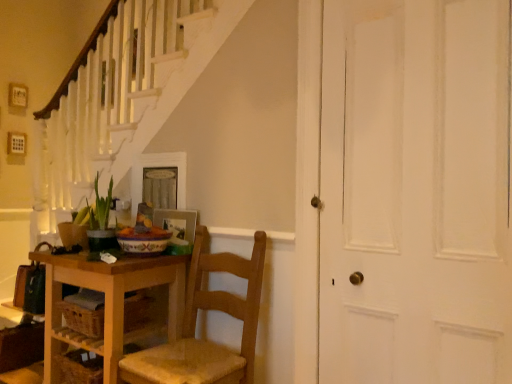
What is the approximate width of wooden drawer at lower left?

wooden drawer at lower left is 17.77 inches wide.

Where is `wooden picture frame at center, the 1th picture frame in the bottom-to-top sequence`? wooden picture frame at center, the 1th picture frame in the bottom-to-top sequence is located at coordinates (177, 223).

The height and width of the screenshot is (384, 512). Describe the element at coordinates (415, 193) in the screenshot. I see `white matte door at right` at that location.

This screenshot has height=384, width=512. Describe the element at coordinates (106, 302) in the screenshot. I see `wooden table at lower left` at that location.

Image resolution: width=512 pixels, height=384 pixels. Find the location of `wooden chair at center`. wooden chair at center is located at coordinates (195, 325).

Describe the element at coordinates (158, 166) in the screenshot. I see `wooden picture frame at lower left, acting as the 2th picture frame starting from the bottom` at that location.

Describe the element at coordinates (98, 220) in the screenshot. The width and height of the screenshot is (512, 384). I see `green leafy plant at lower left` at that location.

Find the location of a particular element. wooden drawer at lower left is located at coordinates (84, 312).

Is wooden picture frame at lower left, acting as the 2th picture frame starting from the bottom, positioned beyond the bounds of green leafy plant at lower left?

Indeed, wooden picture frame at lower left, acting as the 2th picture frame starting from the bottom, is completely outside green leafy plant at lower left.

From the image's perspective, does wooden picture frame at lower left, acting as the 2th picture frame starting from the bottom, appear lower than green leafy plant at lower left?

No.

Does wooden picture frame at lower left, acting as the 2th picture frame starting from the bottom, have a greater height compared to green leafy plant at lower left?

Correct, wooden picture frame at lower left, acting as the 2th picture frame starting from the bottom, is much taller as green leafy plant at lower left.

Is green leafy plant at lower left to the left of wooden picture frame at lower left, acting as the 2th picture frame starting from the bottom, from the viewer's perspective?

Correct, you'll find green leafy plant at lower left to the left of wooden picture frame at lower left, acting as the 2th picture frame starting from the bottom.

Which of these two, green leafy plant at lower left or wooden picture frame at lower left, acting as the 2th picture frame starting from the bottom, is thinner?

wooden picture frame at lower left, acting as the 2th picture frame starting from the bottom.

Is point (242, 336) closer or farther from the camera than point (100, 305)?

Clearly, point (242, 336) is closer to the camera than point (100, 305).

From the image's perspective, is wooden chair at center on top of wooden drawer at lower left?

Actually, wooden chair at center appears below wooden drawer at lower left in the image.

Is wooden chair at center far from wooden drawer at lower left?

That's not correct — wooden chair at center is a little close to wooden drawer at lower left.

Based on the photo, considering the relative positions of wooden chair at center and wooden drawer at lower left in the image provided, is wooden chair at center to the left or to the right of wooden drawer at lower left?

In the image, wooden chair at center appears on the right side of wooden drawer at lower left.

Which point is more forward, (249, 363) or (170, 307)?

The point (249, 363) is in front.

From the image's perspective, is wooden chair at center beneath wooden table at lower left?

No.

Is wooden chair at center outside of wooden table at lower left?

wooden chair at center lies outside wooden table at lower left's area.

Does wooden picture frame at lower left, acting as the 2th picture frame starting from the bottom, turn towards wooden drawer at lower left?

No.

Is wooden picture frame at lower left, acting as the 2th picture frame starting from the bottom, smaller than wooden drawer at lower left?

Yes, wooden picture frame at lower left, acting as the 2th picture frame starting from the bottom, is smaller than wooden drawer at lower left.

Which is nearer, (145, 164) or (129, 299)?

Point (145, 164) appears to be farther away from the viewer than point (129, 299).

Can you confirm if wooden drawer at lower left is thinner than wooden table at lower left?

Yes.

Which object is closer to the camera taking this photo, wooden drawer at lower left or wooden table at lower left?

wooden table at lower left is closer to the camera.

Who is shorter, wooden drawer at lower left or wooden table at lower left?

wooden drawer at lower left is shorter.

Which is in front, point (86, 284) or point (391, 232)?

The point (391, 232) is more forward.

Does wooden table at lower left turn towards white matte door at right?

No, wooden table at lower left is not aimed at white matte door at right.

From the image's perspective, which one is positioned lower, wooden table at lower left or white matte door at right?

wooden table at lower left, from the image's perspective.

From a real-world perspective, does wooden table at lower left stand above white matte door at right?

No, from a real-world perspective, wooden table at lower left is not above white matte door at right.

This screenshot has height=384, width=512. In order to click on houseplant that appears below the wooden picture frame at lower left, the first picture frame positioned from the top (from the image's perspective) in this screenshot , I will do `click(98, 220)`.

Identify the location of houseplant in front of the wooden picture frame at lower left, acting as the 2th picture frame starting from the bottom. (98, 220).

Looking at the image, which one is located further to wooden picture frame at lower left, acting as the 2th picture frame starting from the bottom, white matte door at right or wooden picture frame at center, the second picture frame positioned from the top?

The object further to wooden picture frame at lower left, acting as the 2th picture frame starting from the bottom, is white matte door at right.

From the picture: Estimate the real-world distances between objects in this image. Which object is further from wooden picture frame at center, the 1th picture frame in the bottom-to-top sequence, wooden picture frame at lower left, the first picture frame positioned from the top, or wooden chair at center?

wooden chair at center is further to wooden picture frame at center, the 1th picture frame in the bottom-to-top sequence.

Considering their positions, is wooden picture frame at center, the second picture frame positioned from the top, positioned further to white matte door at right than wooden chair at center?

Among the two, wooden picture frame at center, the second picture frame positioned from the top, is located further to white matte door at right.

Looking at the image, which one is located closer to wooden drawer at lower left, wooden chair at center or wooden table at lower left?

Among the two, wooden table at lower left is located nearer to wooden drawer at lower left.

When comparing their distances from white matte door at right, does wooden chair at center or green leafy plant at lower left seem further?

green leafy plant at lower left lies further to white matte door at right than the other object.

Based on their spatial positions, is wooden chair at center or wooden table at lower left closer to white matte door at right?

The object closer to white matte door at right is wooden chair at center.

Based on the photo, considering their positions, is wooden picture frame at center, the second picture frame positioned from the top, positioned closer to wooden drawer at lower left than green leafy plant at lower left?

Based on the image, green leafy plant at lower left appears to be nearer to wooden drawer at lower left.

Based on their spatial positions, is wooden picture frame at lower left, acting as the 2th picture frame starting from the bottom, or wooden table at lower left further from wooden picture frame at center, the 1th picture frame in the bottom-to-top sequence?

wooden table at lower left lies further to wooden picture frame at center, the 1th picture frame in the bottom-to-top sequence, than the other object.

This screenshot has width=512, height=384. I want to click on chair located between wooden table at lower left and white matte door at right in the left-right direction, so click(x=195, y=325).

At what (x,y) coordinates should I click in order to perform the action: click on drawer between wooden chair at center and wooden picture frame at center, the second picture frame positioned from the top, in the front-back direction. Please return your answer as a coordinate pair (x, y). The width and height of the screenshot is (512, 384). Looking at the image, I should click on (84, 312).

This screenshot has height=384, width=512. What are the coordinates of `picture frame between green leafy plant at lower left and wooden table at lower left in the up-down direction` in the screenshot? It's located at (177, 223).

This screenshot has height=384, width=512. I want to click on picture frame that lies between wooden picture frame at lower left, acting as the 2th picture frame starting from the bottom, and wooden table at lower left from top to bottom, so click(177, 223).